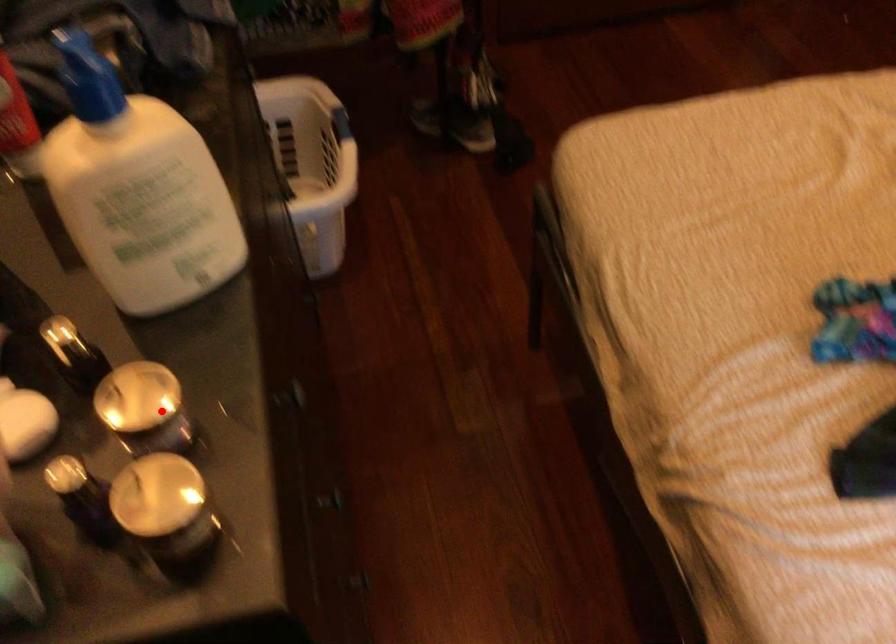
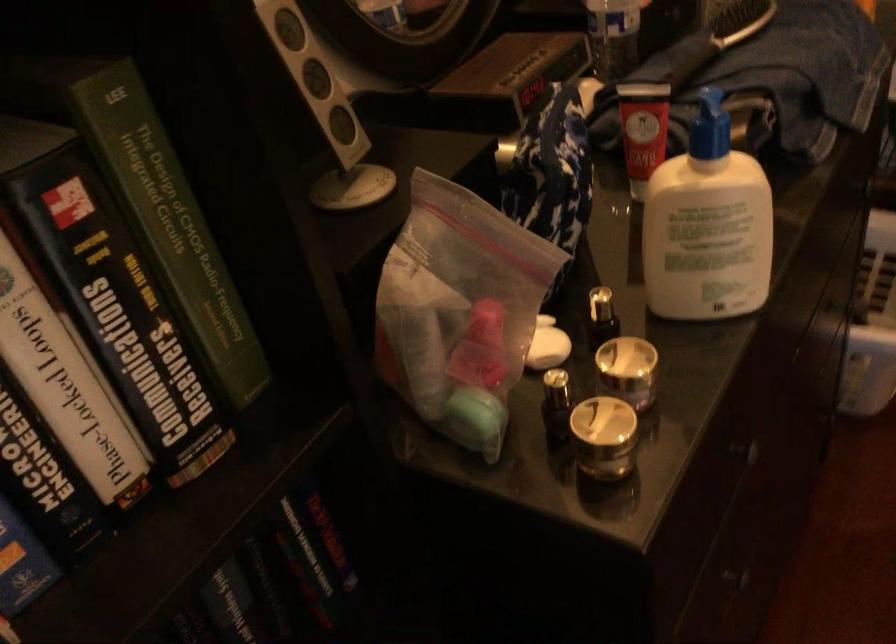
The point at the highlighted location is marked in the first image. Where is the corresponding point in the second image?

(627, 371)